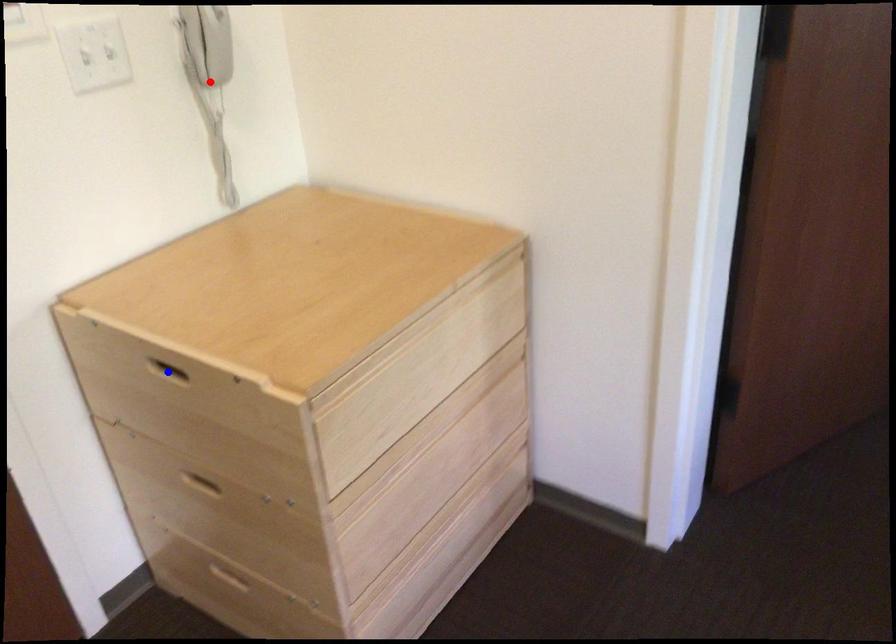
Question: Two points are marked on the image. Which point is closer to the camera?

Choices:
 (A) Blue point is closer.
 (B) Red point is closer.

Answer: (A)